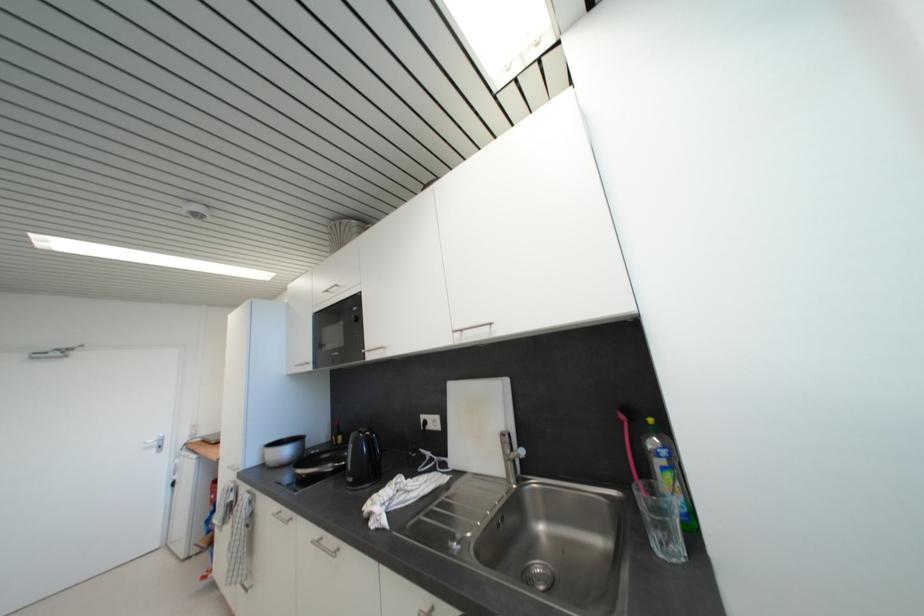
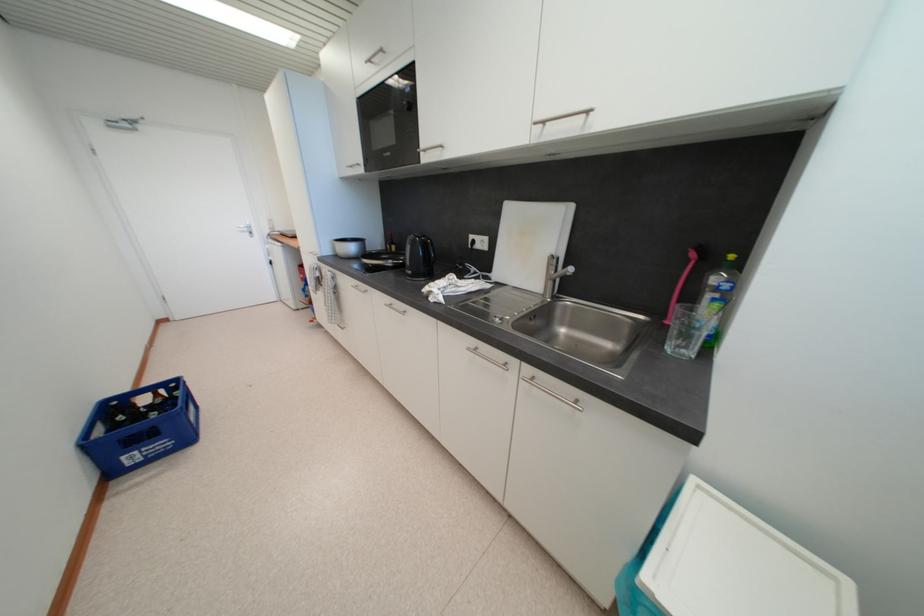
Where in the second image is the point corresponding to point (517, 454) from the first image?

(561, 275)